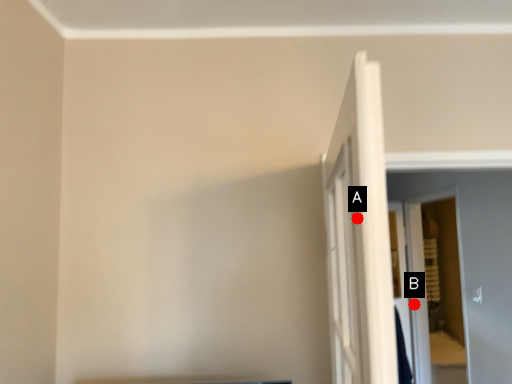
Question: Two points are circled on the image, labeled by A and B beside each circle. Which point appears closest to the camera in this image?

Choices:
 (A) A is closer
 (B) B is closer

Answer: (A)